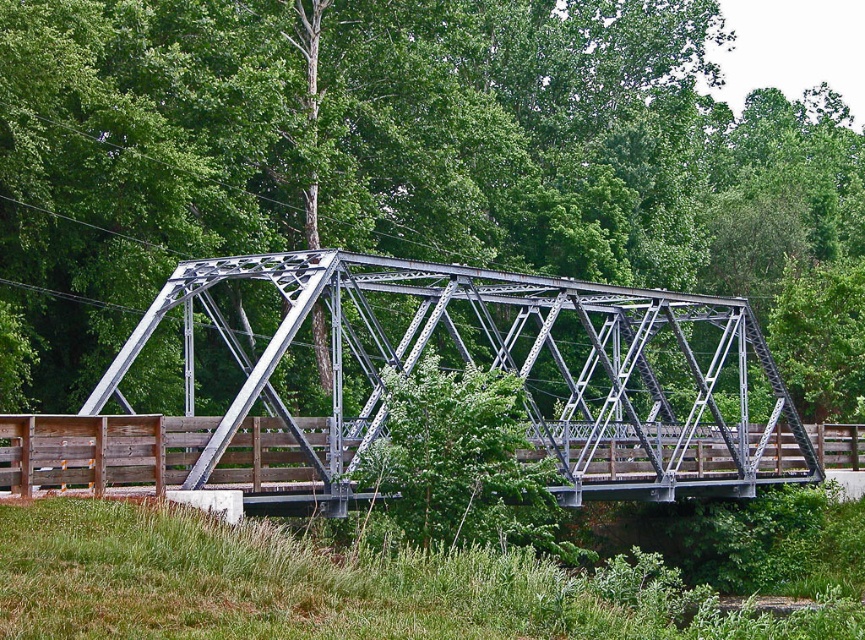
You are standing on the bridge and want to take a photo of the green leafy tree at center and the metallic gray bridge at center. Which object will appear taller in the photo?

The green leafy tree at center will appear taller in the photo because it has a greater height compared to the metallic gray bridge at center.

You are a painter standing on the walkway of the metallic gray bridge at center. You want to paint a scene where the green leafy tree at center is fully visible without any obstruction from the bridge. Is the width of the bridge an issue for your view?

The green leafy tree at center might be wider than the metallic gray bridge at center, so there is a possibility that the tree extends beyond the bridge, allowing you to paint it fully without obstruction from the bridge.

You are standing on the metal truss bridge and want to know the exact coordinates of the green leafy tree at center. What are they?

The green leafy tree at center is located at coordinates point (x=404, y=161).